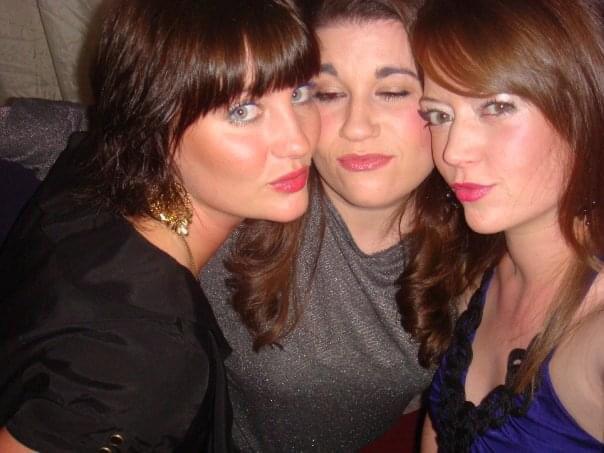
Identify the location of grey cushion. The image size is (604, 453). point(28,32), point(57,24).